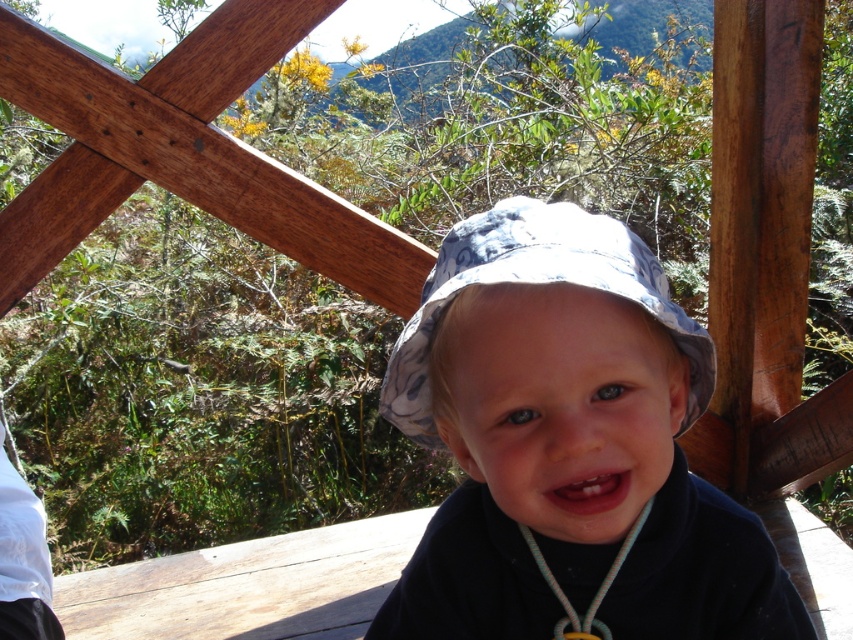
You are an artist trying to sketch the scene. The blue floral fabric hat at center is positioned at coordinates 0.444 on the x and 0.630 on the y axis. If you want to place it exactly in the center of your drawing, which direction should you move it?

The blue floral fabric hat at center is already positioned at coordinates (537, 284). Since the center of a standard coordinate system is typically at (426, 320), you should move it slightly to the right and up to reach the exact center.

You are a photographer trying to capture the blue floral hat at center and the blue floral fabric hat at center in a single shot. Which hat will appear closer to the camera in the photo?

The blue floral hat at center will appear closer to the camera because it is further to the viewer than the blue floral fabric hat at center.